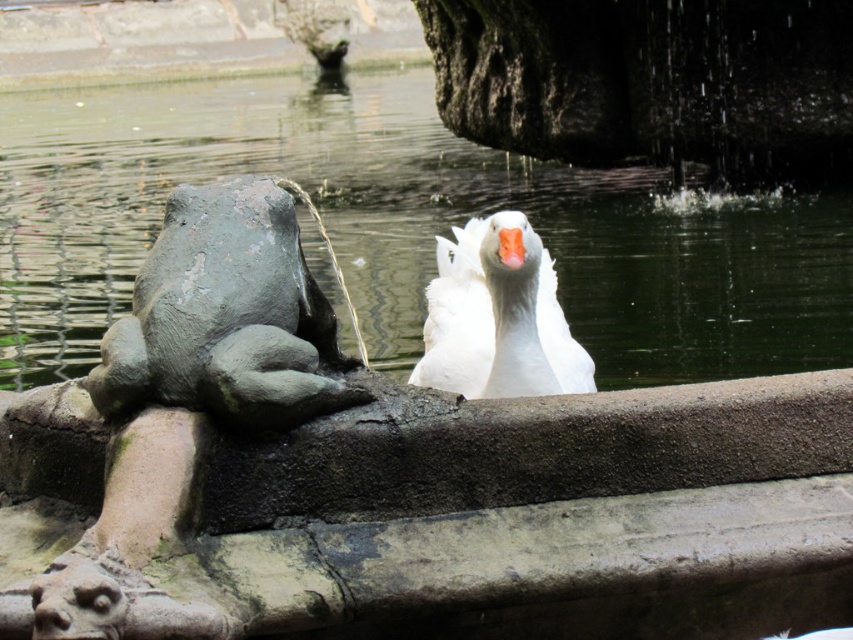
You are standing at a point and want to reach the white duck with a bright orange beak in the water. The coordinates of your current position are point (160,168). Can you estimate how far you are from the duck?

The distance between point (160,168) and the viewer is 36.85 meters, so you are 36.85 meters away from the duck.